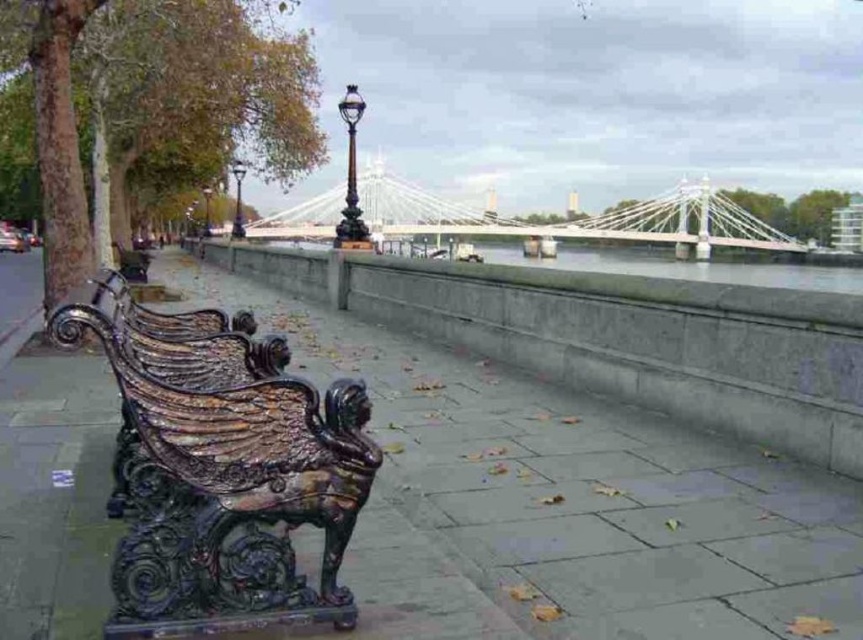
Can you confirm if glossy metal bench at left is shorter than polished dark bronze bench at left?

Incorrect, glossy metal bench at left's height does not fall short of polished dark bronze bench at left's.

Who is higher up, glossy metal bench at left or polished dark bronze bench at left?

glossy metal bench at left is higher up.

At what (x,y) coordinates should I click in order to perform the action: click on glossy metal bench at left. Please return your answer as a coordinate pair (x, y). Looking at the image, I should click on (557, 500).

Can you confirm if polished dark bronze bench at left is thinner than polished dark green bench at center?

Correct, polished dark bronze bench at left's width is less than polished dark green bench at center's.

Does polished dark bronze bench at left have a greater width compared to polished dark green bench at center?

No.

Does point (332, 554) come behind point (117, 256)?

No, (332, 554) is closer to viewer.

The width and height of the screenshot is (863, 640). In order to click on polished dark bronze bench at left in this screenshot , I will do `click(219, 468)`.

Who is lower down, glossy metal bench at left or polished dark green bench at center?

glossy metal bench at left

Which is more to the left, glossy metal bench at left or polished dark green bench at center?

polished dark green bench at center is more to the left.

Does point (87, 509) come behind point (118, 269)?

No, (87, 509) is closer to viewer.

You are a GUI agent. You are given a task and a screenshot of the screen. Output one action in this format:
    pyautogui.click(x=<x>, y=<y>)
    Task: Click on the glossy metal bench at left
    
    Given the screenshot: What is the action you would take?
    pyautogui.click(x=557, y=500)